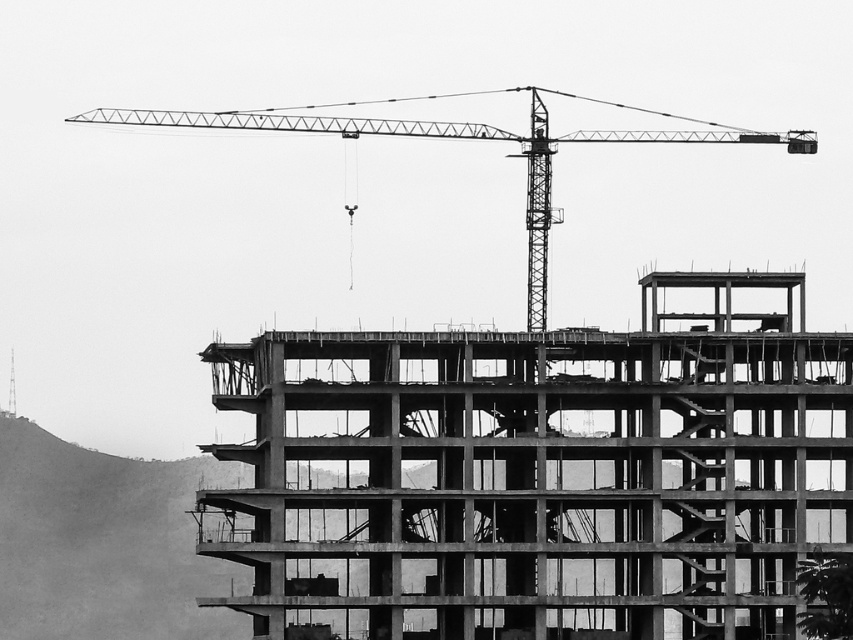
You are a construction worker standing at the base of the crane arm. You need to reach a specific point marked at coordinates point (279, 508). Given that the crane arm is 500 feet long, can you safely reach that point using the crane?

The distance of point (279, 508) from the camera is 524.79 feet. Since the crane arm is only 500 feet long, the crane cannot reach the point (279, 508) as it is beyond its operational range.

Based on the photo, you are an architect reviewing a construction blueprint. You notice the concrete at center and the metallic construction crane at upper center in the image. According to the blueprint, which object is positioned higher in the scene?

The metallic construction crane at upper center is positioned higher than the concrete at center in the scene.